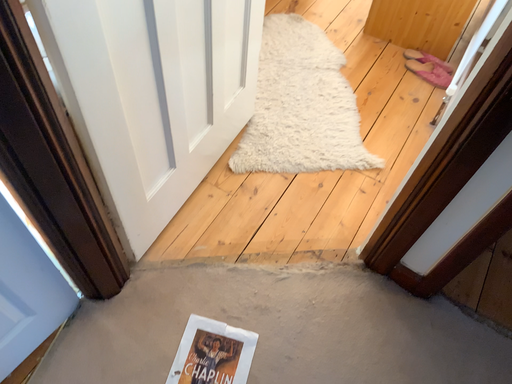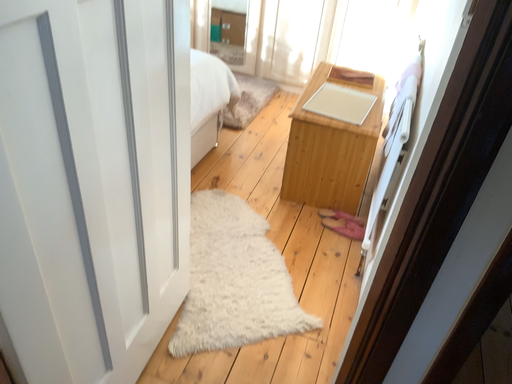
Question: How did the camera likely rotate when shooting the video?

Choices:
 (A) rotated right
 (B) rotated left

Answer: (A)